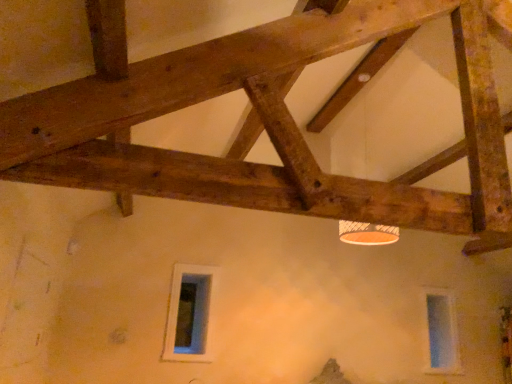
Question: Considering the relative sizes of orange matte lamp at upper center and white glass window at lower center, arranged as the 1th window when viewed from the front, in the image provided, is orange matte lamp at upper center wider than white glass window at lower center, arranged as the 1th window when viewed from the front,?

Choices:
 (A) yes
 (B) no

Answer: (A)

Question: From the image's perspective, is orange matte lamp at upper center located beneath white glass window at lower center, which ranks as the first window in left-to-right order?

Choices:
 (A) yes
 (B) no

Answer: (B)

Question: Does orange matte lamp at upper center have a larger size compared to white glass window at lower center, which ranks as the first window in left-to-right order?

Choices:
 (A) yes
 (B) no

Answer: (A)

Question: From a real-world perspective, is orange matte lamp at upper center located higher than white glass window at lower center, arranged as the 1th window when viewed from the front?

Choices:
 (A) yes
 (B) no

Answer: (A)

Question: From the image's perspective, would you say orange matte lamp at upper center is positioned over white glass window at lower center, the 2th window in the back-to-front sequence?

Choices:
 (A) yes
 (B) no

Answer: (A)

Question: Is orange matte lamp at upper center taller than white glass window at lower center, arranged as the 1th window when viewed from the front?

Choices:
 (A) no
 (B) yes

Answer: (B)

Question: Is transparent glass window at lower right, arranged as the second window when viewed from the front, beside white glass window at lower center, arranged as the 1th window when viewed from the front?

Choices:
 (A) no
 (B) yes

Answer: (A)

Question: From the image's perspective, is transparent glass window at lower right, acting as the 1th window starting from the back, located beneath white glass window at lower center, the 2th window in the back-to-front sequence?

Choices:
 (A) no
 (B) yes

Answer: (B)

Question: From a real-world perspective, is transparent glass window at lower right, the 2th window viewed from the left, on top of white glass window at lower center, which ranks as the first window in left-to-right order?

Choices:
 (A) no
 (B) yes

Answer: (A)

Question: Can you confirm if transparent glass window at lower right, arranged as the second window when viewed from the front, is wider than white glass window at lower center, arranged as the 1th window when viewed from the front?

Choices:
 (A) yes
 (B) no

Answer: (A)

Question: Is transparent glass window at lower right, the 2th window viewed from the left, oriented away from white glass window at lower center, which is the 2th window in right-to-left order?

Choices:
 (A) no
 (B) yes

Answer: (A)

Question: Considering the relative sizes of transparent glass window at lower right, acting as the first window starting from the right, and white glass window at lower center, which ranks as the first window in left-to-right order, in the image provided, is transparent glass window at lower right, acting as the first window starting from the right, bigger than white glass window at lower center, which ranks as the first window in left-to-right order,?

Choices:
 (A) no
 (B) yes

Answer: (B)

Question: Is transparent glass window at lower right, acting as the 1th window starting from the back, shorter than orange matte lamp at upper center?

Choices:
 (A) no
 (B) yes

Answer: (B)